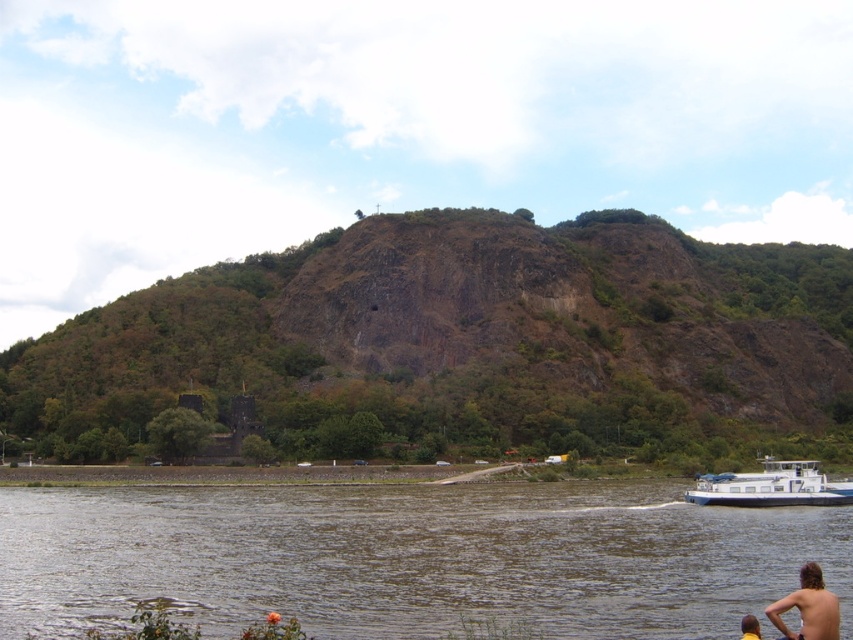
You are standing at the riverside and want to reach the white matte barge at lower right. There is a brown rocky hillside at center blocking your path. Can you walk around the hillside to reach the barge?

The brown rocky hillside at center is 244.53 feet away from the white matte barge at lower right. Since the hillside is between you and the barge, you would need to go around it. However, the distance alone doesn

You are standing on the riverside and want to take a photo of both the brown rocky hillside at center and the white matte barge at lower right. Which object should you adjust your camera angle to focus on first to ensure both are in the frame?

You should focus on the brown rocky hillside at center first because it is positioned over the white matte barge at lower right, so adjusting the angle to include the hillside will naturally include the barge as well.

You are an architect designing a new riverside park. You need to place a large statue that must be smaller than the brown rocky hillside at center. Can the white matte barge at lower right be used as a reference for the statue size? Explain why or why not.

The brown rocky hillside at center is bigger than the white matte barge at lower right. Therefore, the white matte barge at lower right can be used as a reference for the statue size since it is smaller than the hillside.